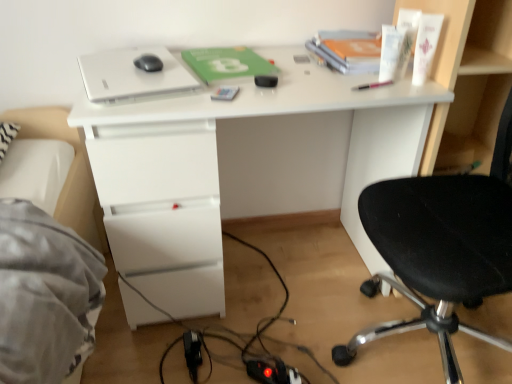
What are the coordinates of `free location to the right of pink plastic pen at upper right, positioned as the 1th stationery in right-to-left order` in the screenshot? It's located at (412, 84).